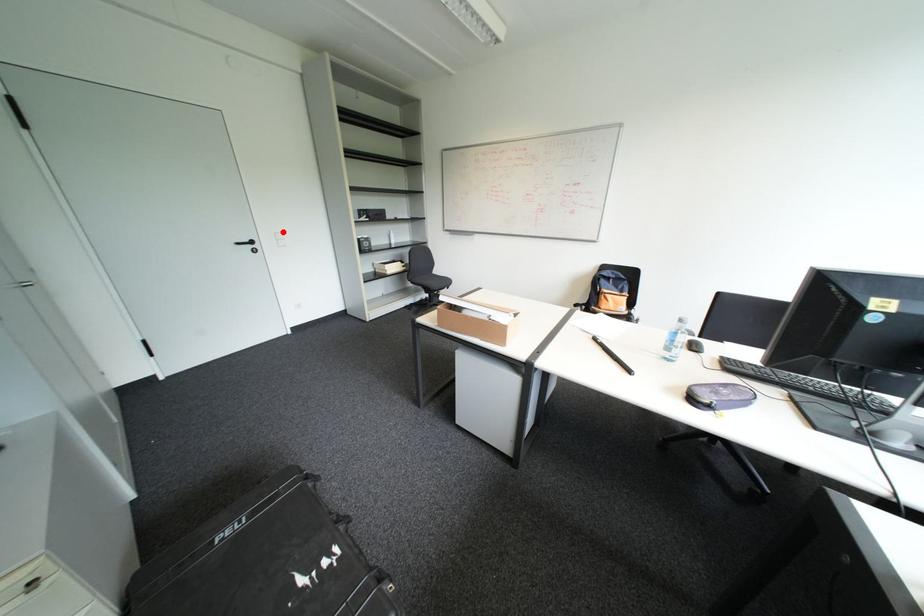
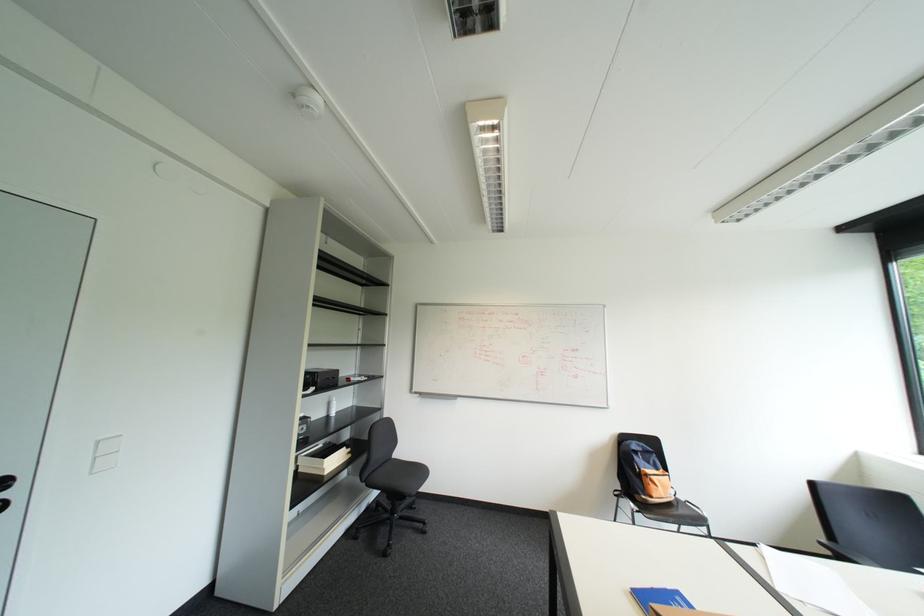
Where in the second image is the point corresponding to the highlighted location from the first image?

(107, 440)